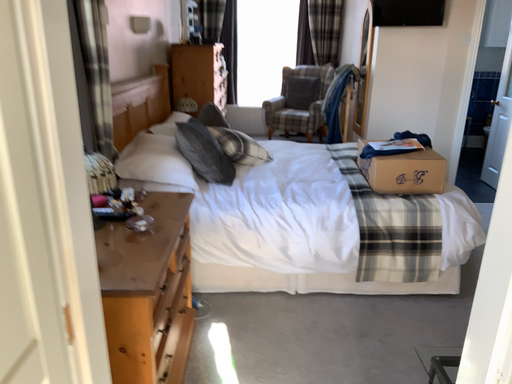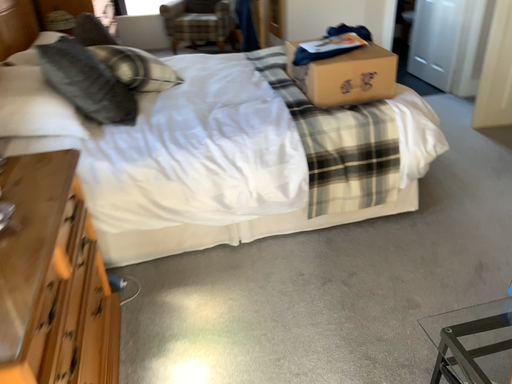
Question: How did the camera likely rotate when shooting the video?

Choices:
 (A) rotated right
 (B) rotated left

Answer: (A)